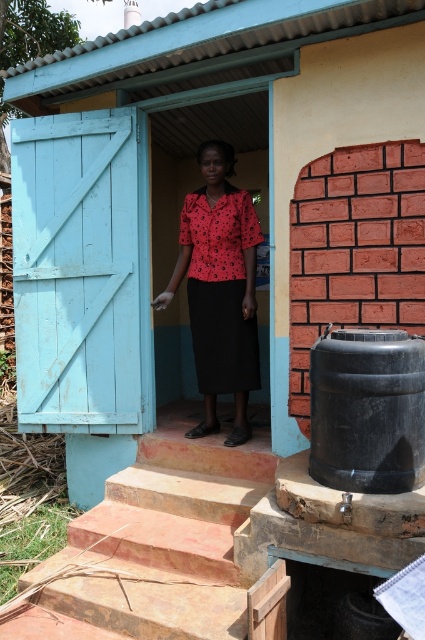
Question: Which object is positioned farthest from the red floral blouse at center?

Choices:
 (A) terracotta stone stairs at center
 (B) black plastic barrel at lower right

Answer: (B)

Question: Considering the relative positions of black plastic barrel at lower right and red floral blouse at center in the image provided, where is black plastic barrel at lower right located with respect to red floral blouse at center?

Choices:
 (A) left
 (B) right

Answer: (B)

Question: Which is farther from the terracotta stone stairs at center?

Choices:
 (A) black plastic barrel at lower right
 (B) red floral blouse at center

Answer: (A)

Question: In this image, where is black plastic barrel at lower right located relative to red floral blouse at center?

Choices:
 (A) above
 (B) below

Answer: (B)

Question: Which point is farther to the camera?

Choices:
 (A) (351, 467)
 (B) (153, 536)

Answer: (B)

Question: Can you confirm if terracotta stone stairs at center is bigger than black plastic barrel at lower right?

Choices:
 (A) yes
 (B) no

Answer: (A)